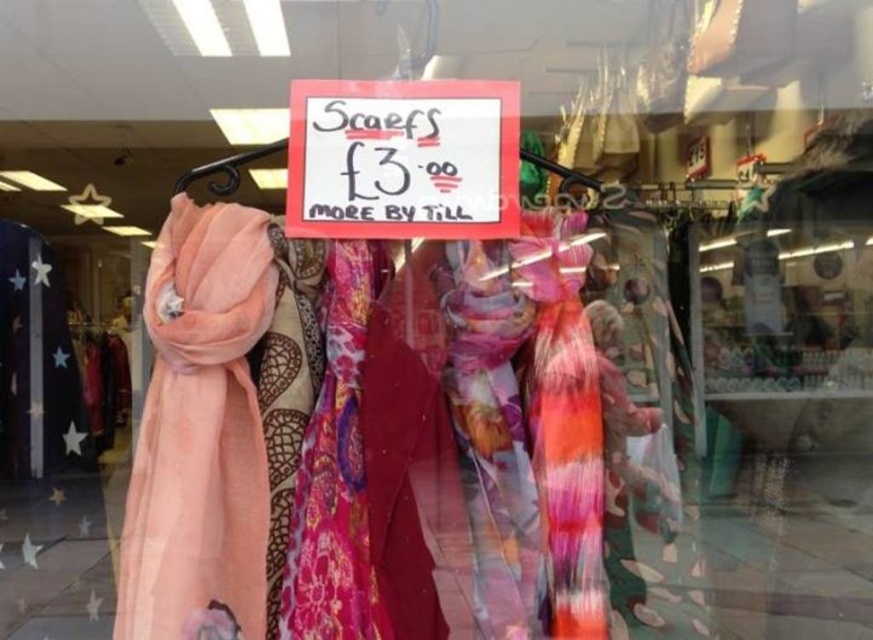
You are a customer in the store looking at the scarves. You see the white paper sign at center and the pink floral scarf at center. Which item is positioned to the right of the other?

The white paper sign at center is to the right of the pink floral scarf at center.

You are a customer in the store looking at the scarves. You want to read the sign above the scarf. Is the white paper sign at center located above the multicolored silky scarf at center?

Yes, the white paper sign at center is positioned over multicolored silky scarf at center, so it is located above it.

You are a customer holding a phone and want to take a clear photo of the white paper sign at center and the pink floral scarf at center. The phone can only focus on one object at a time. Which object should you focus on to ensure both are in focus?

Since the white paper sign at center and pink floral scarf at center are 7.26 inches apart from each other, you should focus on the white paper sign at center because it is closer to the camera. This will ensure both objects are within the depth of field and in focus.